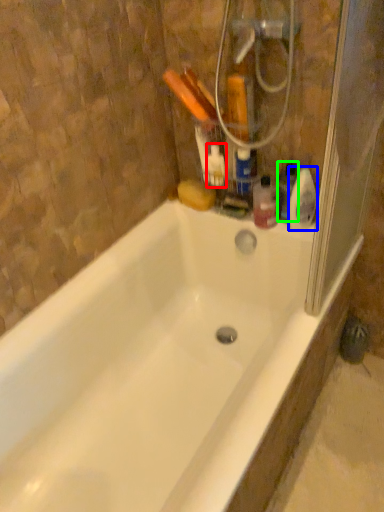
Question: Estimate the real-world distances between objects in this image. Which object is closer to cleaning product (highlighted by a red box), cleaning product (highlighted by a blue box) or cleaning product (highlighted by a green box)?

Choices:
 (A) cleaning product
 (B) cleaning product

Answer: (B)